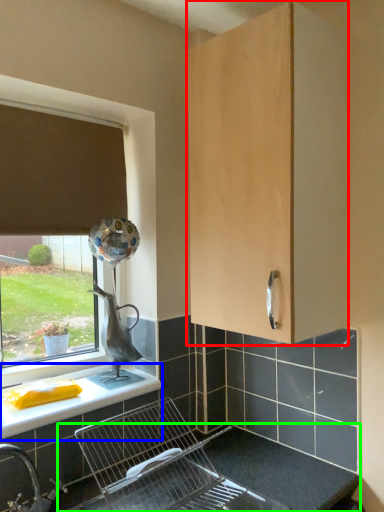
Question: Estimate the real-world distances between objects in this image. Which object is closer to cabinetry (highlighted by a red box), countertop (highlighted by a blue box) or counter top (highlighted by a green box)?

Choices:
 (A) countertop
 (B) counter top

Answer: (B)